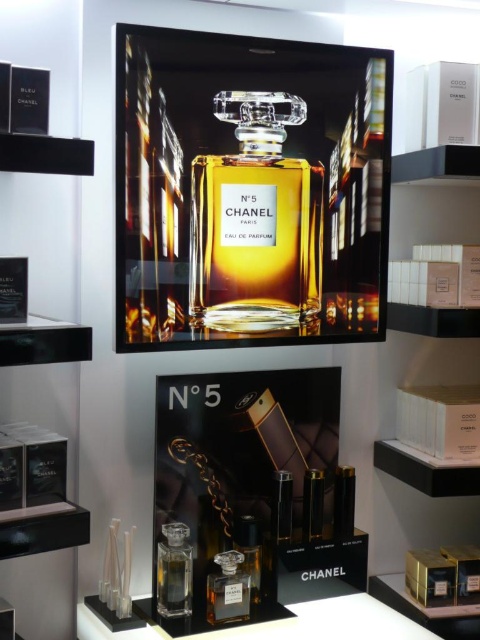
Question: In this image, where is matte glass perfume bottle at center located relative to matte glass perfume at center?

Choices:
 (A) left
 (B) right

Answer: (B)

Question: Which point is farther to the camera?

Choices:
 (A) (180, 570)
 (B) (233, 600)
 (C) (287, 285)

Answer: (C)

Question: Does matte glass perfume bottle at center appear under transparent glass perfume at lower center?

Choices:
 (A) no
 (B) yes

Answer: (A)

Question: In this image, where is transparent glass perfume at lower center located relative to matte glass perfume at center?

Choices:
 (A) above
 (B) below

Answer: (A)

Question: Which of these objects is positioned closest to the transparent glass perfume at lower center?

Choices:
 (A) matte glass perfume at center
 (B) matte glass perfume bottle at center

Answer: (A)

Question: Estimate the real-world distances between objects in this image. Which object is farther from the matte glass perfume bottle at center?

Choices:
 (A) matte glass perfume at center
 (B) transparent glass perfume at lower center

Answer: (A)